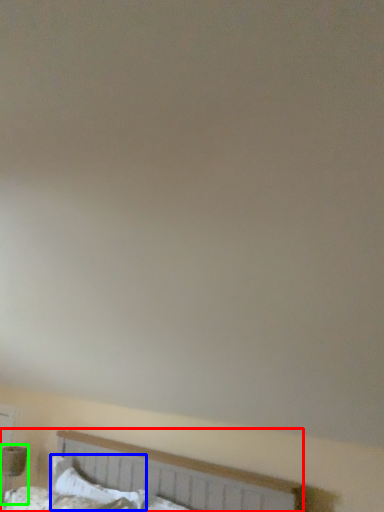
Question: Which is farther away from bed (highlighted by a red box)? pillow (highlighted by a blue box) or table lamp (highlighted by a green box)?

Choices:
 (A) pillow
 (B) table lamp

Answer: (B)